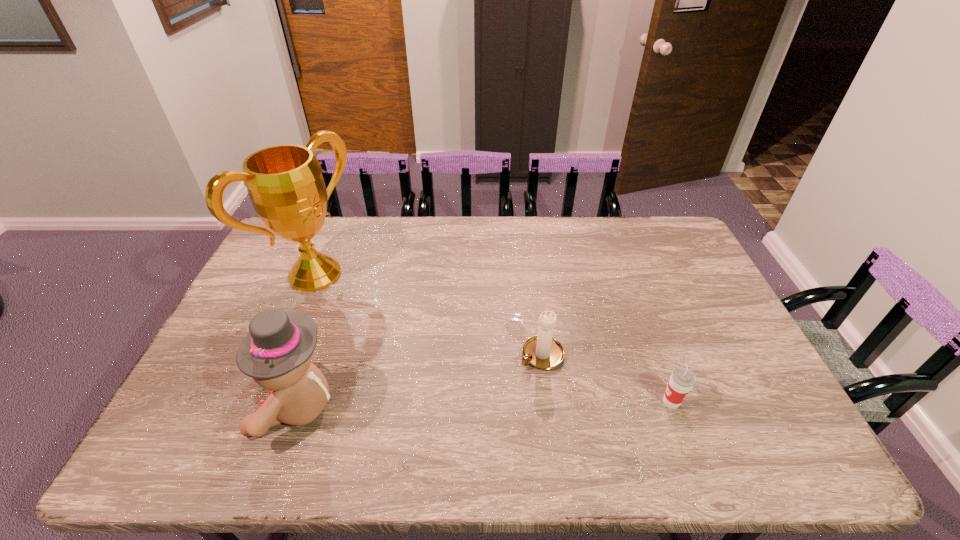
Image resolution: width=960 pixels, height=540 pixels. What are the coordinates of `cup at the near edge` in the screenshot? It's located at (682, 379).

The image size is (960, 540). I want to click on object that is at the left edge, so click(x=285, y=184).

I want to click on object that is positioned at the far left corner, so click(285, 184).

Image resolution: width=960 pixels, height=540 pixels. I want to click on blank space at the far edge of the desktop, so click(478, 238).

The width and height of the screenshot is (960, 540). I want to click on vacant space at the left edge, so click(284, 293).

Image resolution: width=960 pixels, height=540 pixels. In order to click on free space at the right edge of the desktop in this screenshot , I will do 661,261.

Locate an element on the screen. free location at the far left corner is located at coordinates (291, 252).

Where is `vacant point located between the rag_doll and the rightmost object`? vacant point located between the rag_doll and the rightmost object is located at coordinates (484, 404).

Image resolution: width=960 pixels, height=540 pixels. In order to click on vacant area that lies between the tallest object and the candle holder in this screenshot , I will do `click(428, 314)`.

You are a GUI agent. You are given a task and a screenshot of the screen. Output one action in this format:
    pyautogui.click(x=<x>, y=<y>)
    Task: Click on the free space that is in between the cup and the second object from right to left
    
    Given the screenshot: What is the action you would take?
    pyautogui.click(x=607, y=379)